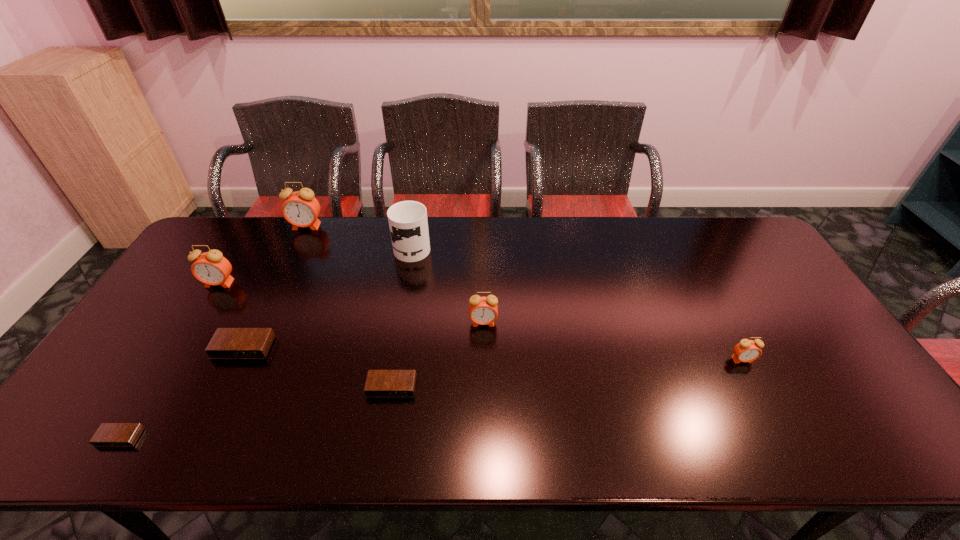
Identify the location of the farthest alarm clock. (301, 209).

The width and height of the screenshot is (960, 540). I want to click on the third pink alarm clock from right to left, so click(x=301, y=209).

The width and height of the screenshot is (960, 540). In order to click on mug in this screenshot , I will do pyautogui.click(x=408, y=223).

At what (x,y) coordinates should I click in order to perform the action: click on the second farthest object. Please return your answer as a coordinate pair (x, y). The image size is (960, 540). Looking at the image, I should click on (408, 223).

At what (x,y) coordinates should I click in order to perform the action: click on the third smallest pink alarm clock. Please return your answer as a coordinate pair (x, y). Looking at the image, I should click on (211, 268).

What are the coordinates of `the third farthest object` in the screenshot? It's located at tap(211, 268).

Locate an element on the screen. The image size is (960, 540). the fifth shortest object is located at coordinates (482, 310).

The image size is (960, 540). Find the location of `the second smallest pink alarm clock`. the second smallest pink alarm clock is located at coordinates (482, 310).

Where is `the rightmost object`? The image size is (960, 540). the rightmost object is located at coordinates (747, 350).

You are a GUI agent. You are given a task and a screenshot of the screen. Output one action in this format:
    pyautogui.click(x=<x>, y=<y>)
    Task: Click on the rightmost pink alarm clock
    This screenshot has height=540, width=960.
    Given the screenshot: What is the action you would take?
    [x=747, y=350]